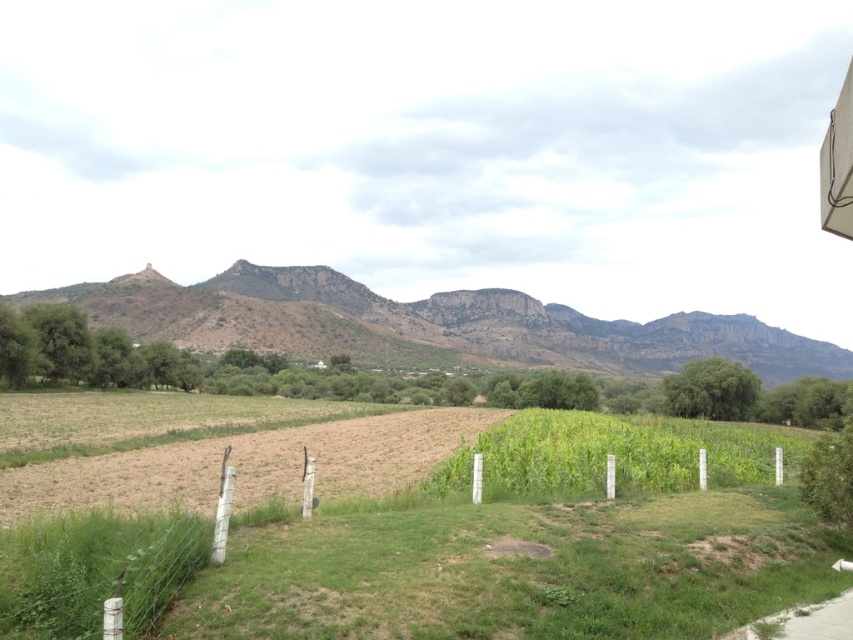
Measure the distance between green grassy vineyard at center and dull brown rock at center.

A distance of 249.84 meters exists between green grassy vineyard at center and dull brown rock at center.

Can you confirm if green grassy vineyard at center is positioned to the right of dull brown rock at center?

In fact, green grassy vineyard at center is to the left of dull brown rock at center.

Image resolution: width=853 pixels, height=640 pixels. I want to click on green grassy vineyard at center, so click(x=492, y=552).

This screenshot has height=640, width=853. I want to click on green grassy vineyard at center, so click(492, 552).

Is green grassy vineyard at center to the right of green plastic fence at center from the viewer's perspective?

Incorrect, green grassy vineyard at center is not on the right side of green plastic fence at center.

Does green grassy vineyard at center lie in front of green plastic fence at center?

Yes, it is.

Does point (202, 499) lie behind point (616, 444)?

No, (202, 499) is closer to viewer.

Locate an element on the screen. This screenshot has height=640, width=853. green grassy vineyard at center is located at coordinates (492, 552).

Where is `dull brown rock at center`? Image resolution: width=853 pixels, height=640 pixels. dull brown rock at center is located at coordinates (427, 323).

Does point (238, 266) come farther from viewer compared to point (656, 465)?

Yes, it is behind point (656, 465).

At what (x,y) coordinates should I click in order to perform the action: click on dull brown rock at center. Please return your answer as a coordinate pair (x, y). Looking at the image, I should click on (427, 323).